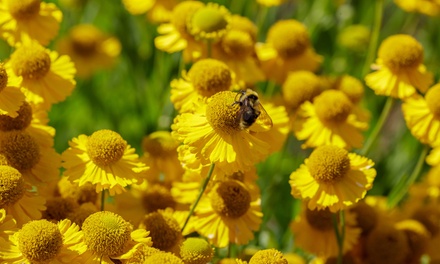
In order to click on plant most to the right in this screenshot , I will do `click(438, 100)`.